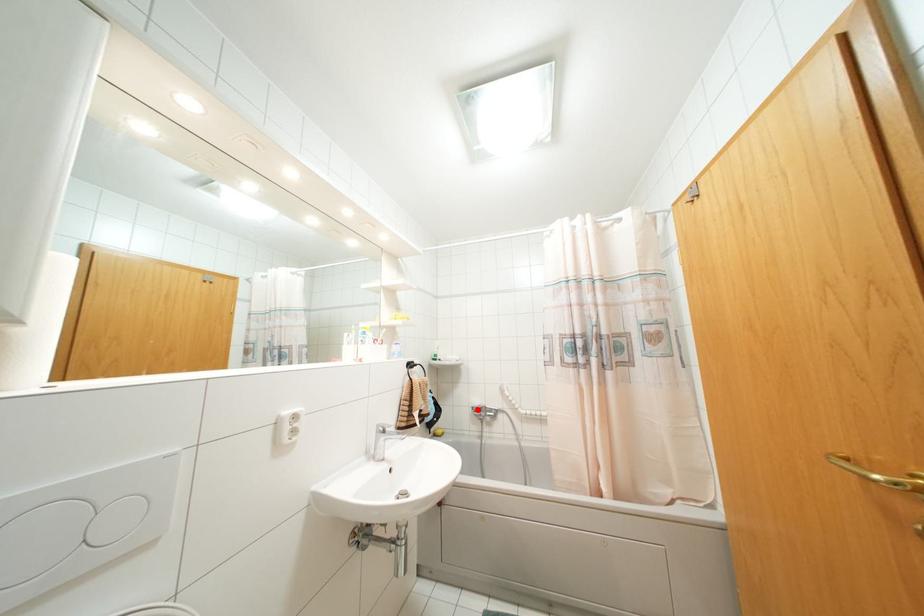
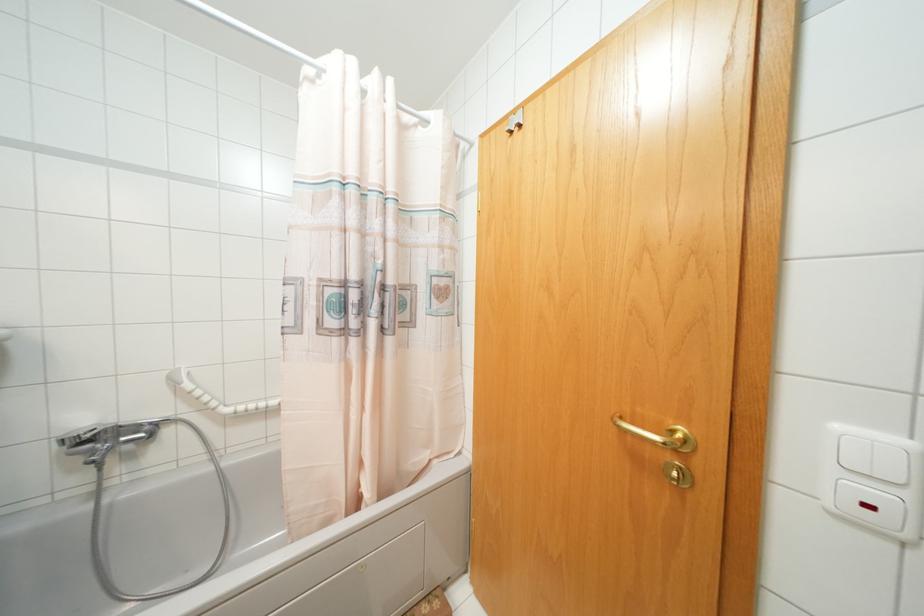
Question: A red point is marked in image1. In image2, is the corresponding 3D point closer to the camera or farther? Reply with the corresponding letter.

Choices:
 (A) The corresponding 3D point is closer.
 (B) The corresponding 3D point is farther.

Answer: (A)